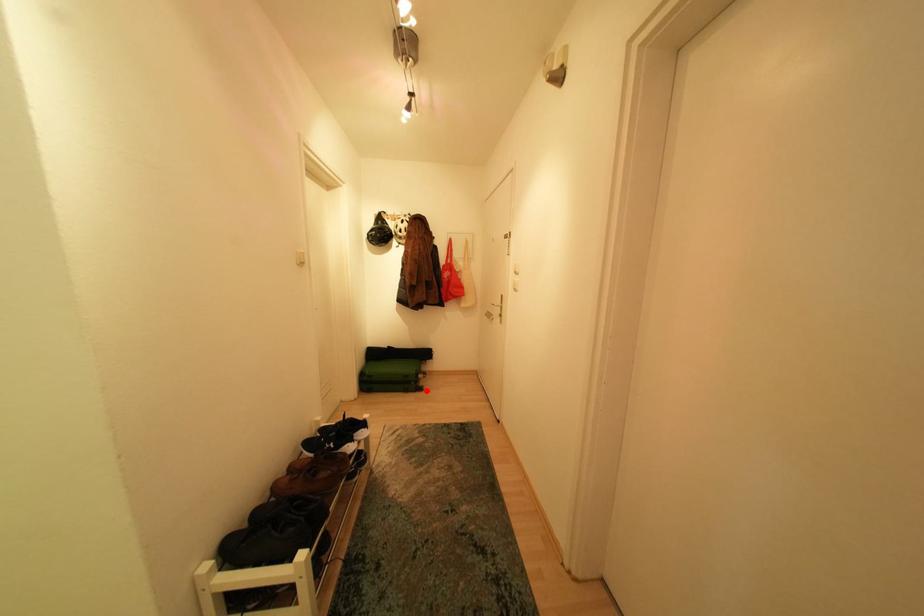
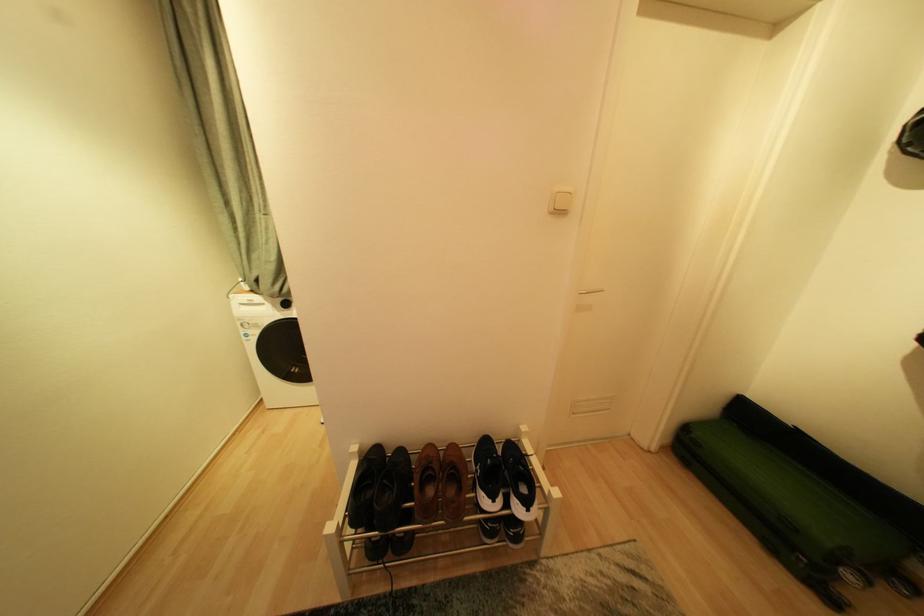
In the second image, find the point that corresponds to the highlighted location in the first image.

(834, 599)